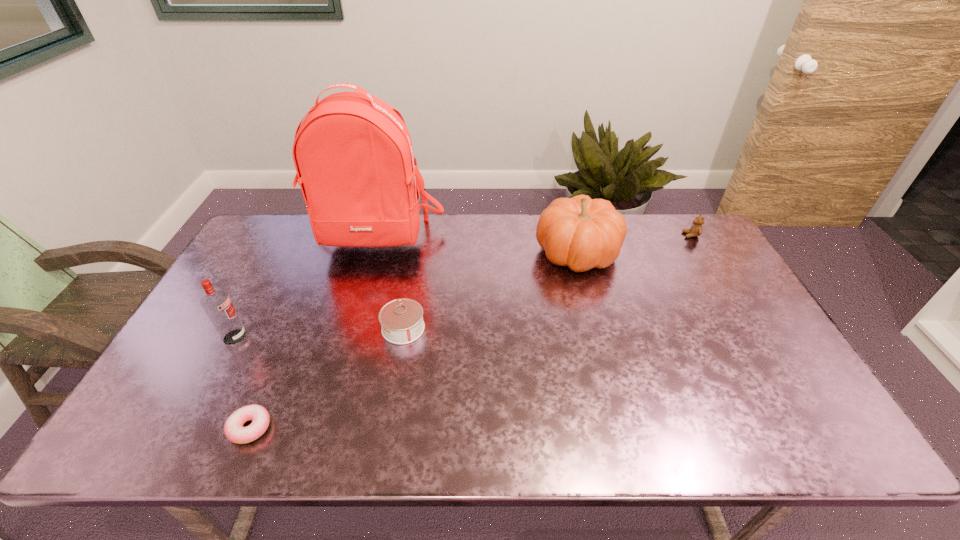
I want to click on object at the left edge, so click(x=217, y=304).

This screenshot has height=540, width=960. I want to click on object present at the right edge, so click(x=696, y=229).

Identify the location of object located at the far right corner. (696, 229).

This screenshot has height=540, width=960. In the image, there is a desktop. In order to click on vacant space at the far edge in this screenshot , I will do `click(446, 215)`.

Where is `vacant space at the near edge of the desktop`? The width and height of the screenshot is (960, 540). vacant space at the near edge of the desktop is located at coordinates (375, 432).

Find the location of a particular element. free space at the left edge of the desktop is located at coordinates pyautogui.click(x=249, y=313).

This screenshot has height=540, width=960. I want to click on vacant area at the right edge, so click(x=762, y=364).

At what (x,y) coordinates should I click in order to perform the action: click on vacant space at the far left corner of the desktop. Please return your answer as a coordinate pair (x, y). Looking at the image, I should click on [276, 232].

The image size is (960, 540). In order to click on vacant space at the near left corner of the desktop in this screenshot , I will do pyautogui.click(x=156, y=430).

I want to click on vacant point at the near right corner, so click(845, 451).